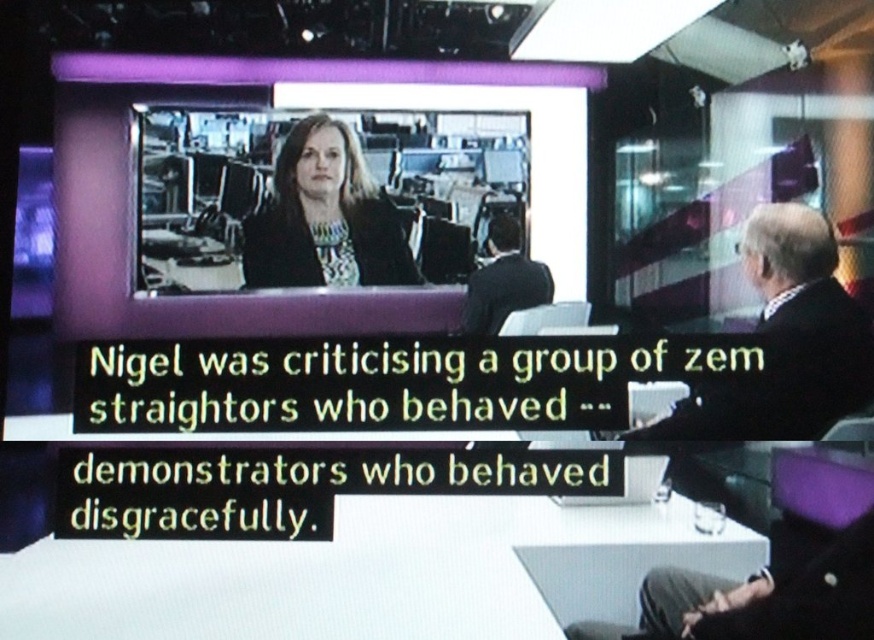
Based on the photo, measure the distance from matte black laptop at upper center to dark suit at center.

A distance of 10.32 inches exists between matte black laptop at upper center and dark suit at center.

Can you confirm if matte black laptop at upper center is smaller than dark suit at center?

Incorrect, matte black laptop at upper center is not smaller in size than dark suit at center.

Between point (269, 269) and point (526, 266), which one is positioned behind?

Positioned behind is point (526, 266).

This screenshot has width=874, height=640. Identify the location of matte black laptop at upper center. (311, 200).

Between black wool suit at right and matte black jacket at center, which one is positioned higher?

matte black jacket at center

Can you confirm if black wool suit at right is positioned to the right of matte black jacket at center?

Correct, you'll find black wool suit at right to the right of matte black jacket at center.

Which is in front, point (831, 314) or point (338, 248)?

Point (831, 314) is in front.

The width and height of the screenshot is (874, 640). Identify the location of black wool suit at right. (785, 342).

Based on the photo, can you confirm if matte black laptop at upper center is positioned to the left of black wool suit at right?

Indeed, matte black laptop at upper center is positioned on the left side of black wool suit at right.

Can you confirm if matte black laptop at upper center is positioned to the right of black wool suit at right?

No, matte black laptop at upper center is not to the right of black wool suit at right.

Between point (219, 260) and point (806, 227), which one is positioned in front?

Point (806, 227) is in front.

Where is `matte black laptop at upper center`? The image size is (874, 640). matte black laptop at upper center is located at coordinates (311, 200).